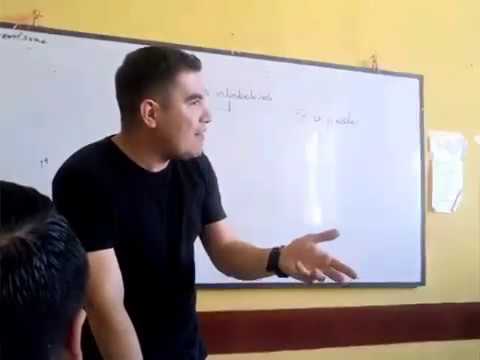
Find the location of `2 colors in wall`. 2 colors in wall is located at coordinates [x=453, y=258], [x=451, y=324].